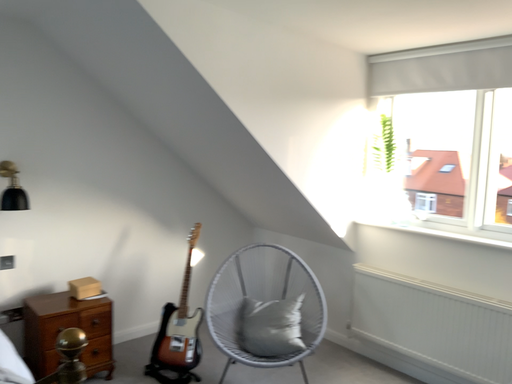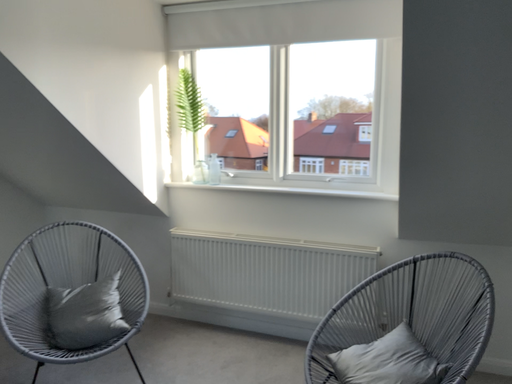
Question: How did the camera likely rotate when shooting the video?

Choices:
 (A) rotated left
 (B) rotated right

Answer: (B)